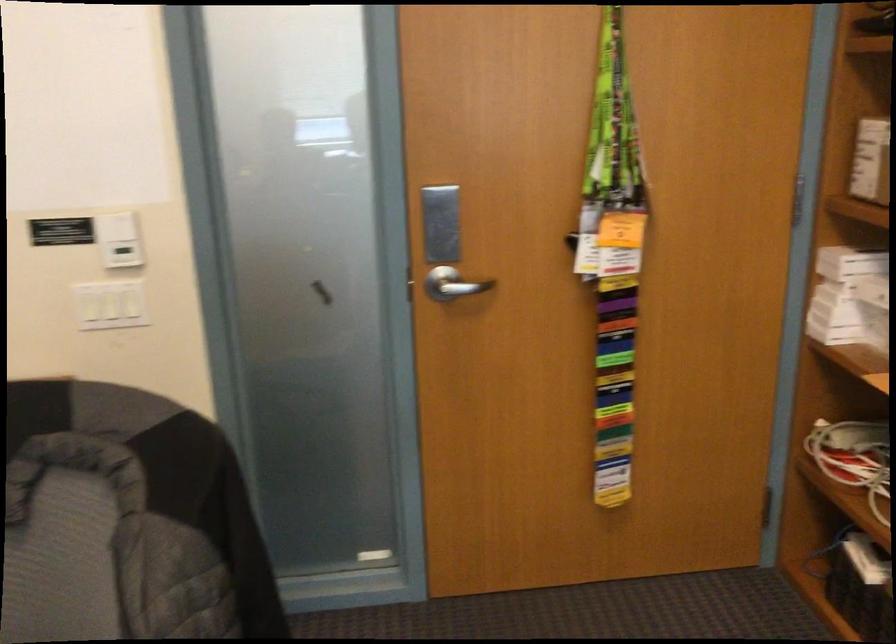
Where would you pull the silver door handle? Please return your answer as a coordinate pair (x, y).

(452, 283)